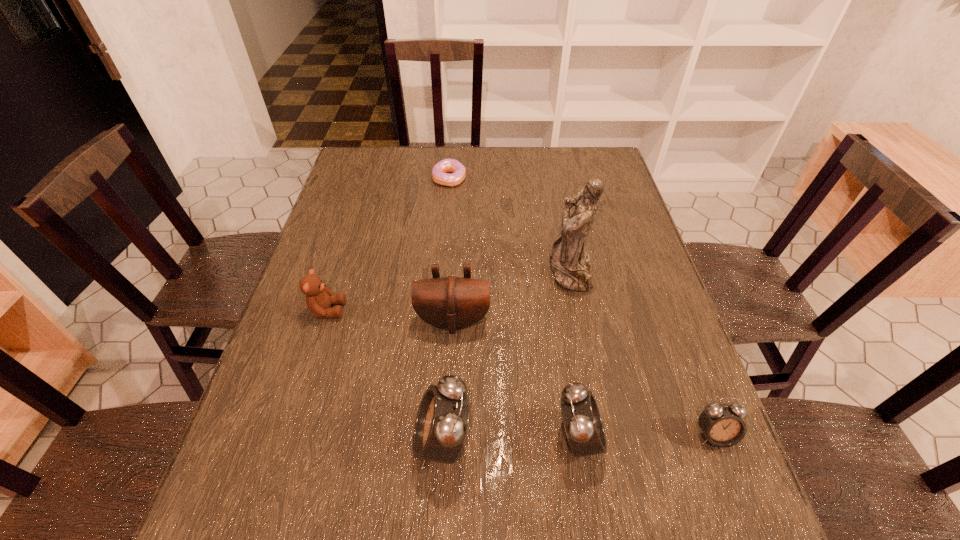
Locate an element on the screen. The width and height of the screenshot is (960, 540). free space located on the face of the leftmost alarm clock is located at coordinates tap(239, 441).

Find the location of a particular element. Image resolution: width=960 pixels, height=540 pixels. free space located 0.250m on the face of the leftmost alarm clock is located at coordinates (285, 441).

Locate an element on the screen. The image size is (960, 540). vacant space located on the face of the leftmost alarm clock is located at coordinates (358, 441).

You are a GUI agent. You are given a task and a screenshot of the screen. Output one action in this format:
    pyautogui.click(x=<x>, y=<y>)
    Task: Click on the free region located 0.200m on the face of the second tallest alarm clock
    This screenshot has width=960, height=540.
    Given the screenshot: What is the action you would take?
    point(706,438)

The image size is (960, 540). Identify the location of vacant region located 0.120m on the back of the shortest object. (451, 151).

Where is `vacant space situated on the front-facing side of the second farthest object`? The width and height of the screenshot is (960, 540). vacant space situated on the front-facing side of the second farthest object is located at coordinates (460, 271).

Locate an element on the screen. free space located 0.350m on the front-facing side of the second farthest object is located at coordinates (419, 271).

You are a GUI agent. You are given a task and a screenshot of the screen. Output one action in this format:
    pyautogui.click(x=<x>, y=<y>)
    Task: Click on the vacant space situated on the front-facing side of the second farthest object
    Image resolution: width=960 pixels, height=540 pixels.
    Given the screenshot: What is the action you would take?
    pyautogui.click(x=460, y=271)

Identify the location of vacant space located 0.200m with the flap open on the pouch. Image resolution: width=960 pixels, height=540 pixels. (448, 416).

This screenshot has width=960, height=540. Identify the location of vacant space located 0.110m on the face of the leftmost object. (390, 310).